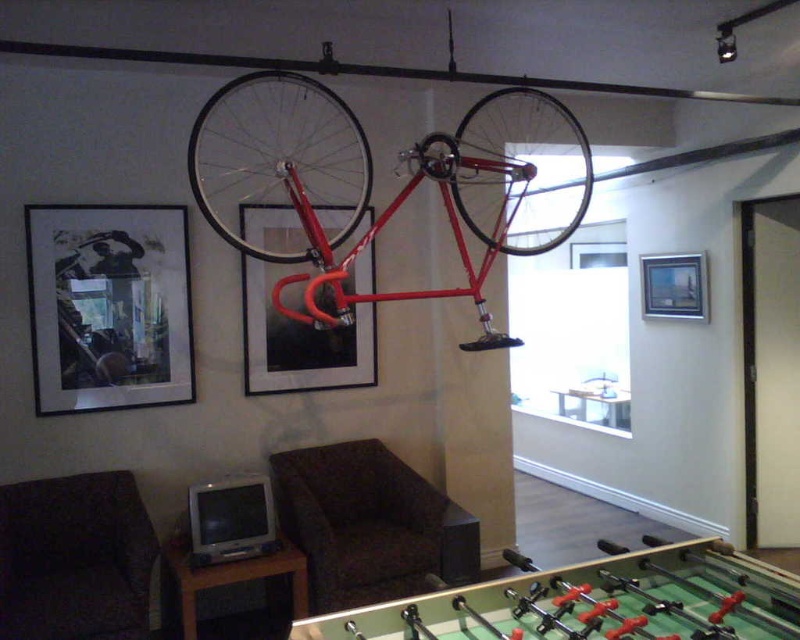
Question: In this image, where is matte black picture frame at center located relative to wooden picture frame at upper right?

Choices:
 (A) left
 (B) right

Answer: (A)

Question: Based on their relative distances, which object is farther from the wooden picture frame at upper right?

Choices:
 (A) matte black picture frame at upper left
 (B) matte black picture frame at center
 (C) shiny red bicycle at upper center

Answer: (A)

Question: Can you confirm if shiny red bicycle at upper center is smaller than matte black picture frame at upper left?

Choices:
 (A) no
 (B) yes

Answer: (A)

Question: In this image, where is shiny red bicycle at upper center located relative to wooden picture frame at upper right?

Choices:
 (A) right
 (B) left

Answer: (B)

Question: Which object is closer to the camera taking this photo?

Choices:
 (A) shiny red bicycle at upper center
 (B) wooden picture frame at upper right
 (C) matte black picture frame at upper left

Answer: (A)

Question: Which of these objects is positioned farthest from the matte black picture frame at upper left?

Choices:
 (A) matte black picture frame at center
 (B) shiny red bicycle at upper center

Answer: (B)